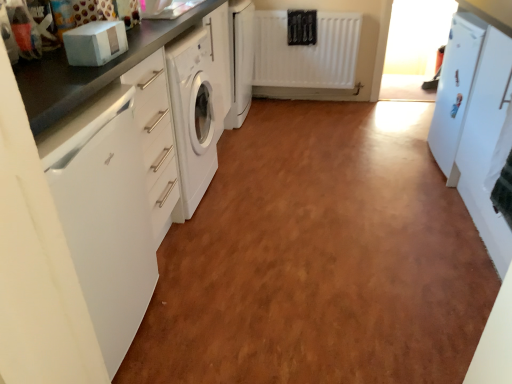
What is the approximate height of white matte refrigerator at right, arranged as the 1th cabinetry when ordered from the bottom?

white matte refrigerator at right, arranged as the 1th cabinetry when ordered from the bottom, is 36.54 inches tall.

Image resolution: width=512 pixels, height=384 pixels. Describe the element at coordinates (92, 69) in the screenshot. I see `matte black countertop at left` at that location.

Measure the distance between matte black countertop at left and camera.

A distance of 36.86 inches exists between matte black countertop at left and camera.

This screenshot has width=512, height=384. Describe the element at coordinates (240, 60) in the screenshot. I see `white glossy washing machine at center, which appears as the second cabinetry when ordered from the bottom` at that location.

From the picture: Measure the distance between white matte radiator at center and camera.

white matte radiator at center and camera are 3.28 meters apart from each other.

At what (x,y) coordinates should I click in order to perform the action: click on white glossy countertop at left. Please return your answer as a coordinate pair (x, y). The height and width of the screenshot is (384, 512). Looking at the image, I should click on (91, 70).

Where is `white matte refrigerator at right, which is the second cabinetry in top-to-bottom order`? This screenshot has width=512, height=384. white matte refrigerator at right, which is the second cabinetry in top-to-bottom order is located at coordinates tap(474, 120).

Does white glossy washing machine at center, positioned as the 1th cabinetry in top-to-bottom order, have a larger size compared to white glossy countertop at left?

No.

How different are the orientations of white glossy washing machine at center, the second cabinetry when ordered from front to back, and white glossy countertop at left in degrees?

They differ by 0.123 degrees in their facing directions.

Which object is further away from the camera taking this photo, white glossy washing machine at center, the second cabinetry in the right-to-left sequence, or white glossy countertop at left?

white glossy washing machine at center, the second cabinetry in the right-to-left sequence.

Which is closer to the camera, (233, 63) or (105, 68)?

Point (233, 63) is positioned farther from the camera compared to point (105, 68).

Where is `countertop that is behind the white matte refrigerator at right, which appears as the second cabinetry when viewed from the back`? countertop that is behind the white matte refrigerator at right, which appears as the second cabinetry when viewed from the back is located at coordinates (92, 69).

Is matte black countertop at left completely or partially outside of white matte refrigerator at right, acting as the second cabinetry starting from the left?

Yes.

Is matte black countertop at left further to the viewer compared to white matte refrigerator at right, acting as the second cabinetry starting from the left?

Yes, it is behind white matte refrigerator at right, acting as the second cabinetry starting from the left.

Is point (32, 89) closer or farther from the camera than point (486, 175)?

Point (32, 89) appears to be closer to the viewer than point (486, 175).

You are a GUI agent. You are given a task and a screenshot of the screen. Output one action in this format:
    pyautogui.click(x=<x>, y=<y>)
    Task: Click on the radiator located behind the white glossy countertop at left
    This screenshot has height=384, width=512.
    Given the screenshot: What is the action you would take?
    pyautogui.click(x=306, y=52)

Is point (326, 14) farther from camera compared to point (70, 75)?

Yes.

Looking at this image, who is more distant, white matte radiator at center or white glossy countertop at left?

white matte radiator at center is further from the camera.

From the image's perspective, relative to white matte refrigerator at right, arranged as the 1th cabinetry when viewed from the front, is white glossy washing machine at center, the second cabinetry in the right-to-left sequence, above or below?

Based on their image positions, white glossy washing machine at center, the second cabinetry in the right-to-left sequence, is located above white matte refrigerator at right, arranged as the 1th cabinetry when viewed from the front.

Is white matte refrigerator at right, which appears as the second cabinetry when viewed from the back, at the back of white glossy washing machine at center, which is the first cabinetry in back-to-front order?

white glossy washing machine at center, which is the first cabinetry in back-to-front order, is not turned away from white matte refrigerator at right, which appears as the second cabinetry when viewed from the back.

Which of these two, white glossy washing machine at center, the second cabinetry in the right-to-left sequence, or white matte refrigerator at right, which is the second cabinetry in top-to-bottom order, is thinner?

Thinner between the two is white glossy washing machine at center, the second cabinetry in the right-to-left sequence.

Which is less distant, [237,17] or [468,96]?

The point [468,96] is in front.

Is white glossy refrigerator at right at the back of white matte radiator at center?

No, white matte radiator at center is not facing the opposite direction of white glossy refrigerator at right.

Locate an element on the screen. appliance above the white matte radiator at center (from a real-world perspective) is located at coordinates (455, 89).

From the image's perspective, relative to white glossy refrigerator at right, is white matte radiator at center above or below?

From the image's perspective, white matte radiator at center appears above white glossy refrigerator at right.

Which of these two, white matte radiator at center or white glossy refrigerator at right, is thinner?

With smaller width is white matte radiator at center.

Is white glossy washing machine at center, positioned as the 1th cabinetry in top-to-bottom order, far from matte black countertop at left?

Yes, white glossy washing machine at center, positioned as the 1th cabinetry in top-to-bottom order, is far from matte black countertop at left.

In order to click on cabinetry behind the matte black countertop at left in this screenshot , I will do `click(240, 60)`.

Based on their sizes in the image, would you say white glossy washing machine at center, which appears as the second cabinetry when ordered from the bottom, is bigger or smaller than matte black countertop at left?

Clearly, white glossy washing machine at center, which appears as the second cabinetry when ordered from the bottom, is smaller in size than matte black countertop at left.

Is point (249, 77) farther from camera compared to point (57, 84)?

Yes.

Identify the location of cabinetry that is the 2nd object located above the white glossy dishwasher at left (from the image's perspective). Image resolution: width=512 pixels, height=384 pixels. (240, 60).

From the image's perspective, which one is positioned lower, white glossy dishwasher at left or white glossy washing machine at center, positioned as the 1th cabinetry in top-to-bottom order?

white glossy dishwasher at left appears lower in the image.

Is white glossy dishwasher at left taller or shorter than white glossy washing machine at center, which is the first cabinetry in back-to-front order?

Clearly, white glossy dishwasher at left is shorter compared to white glossy washing machine at center, which is the first cabinetry in back-to-front order.

Who is smaller, white glossy dishwasher at left or white glossy washing machine at center, the second cabinetry when ordered from front to back?

With smaller size is white glossy washing machine at center, the second cabinetry when ordered from front to back.

Which cabinetry is the 1st one when counting from the right side of the white glossy countertop at left? Please provide its 2D coordinates.

[(240, 60)]

What are the coordinates of `countertop that is on the left side of white matte refrigerator at right, arranged as the 1th cabinetry when viewed from the front` in the screenshot? It's located at (92, 69).

Considering their positions, is matte black countertop at left positioned closer to white matte refrigerator at right, placed as the first cabinetry when sorted from right to left, than white glossy countertop at left?

Among the two, white glossy countertop at left is located nearer to white matte refrigerator at right, placed as the first cabinetry when sorted from right to left.

Based on their spatial positions, is white glossy washing machine at center, which is the first cabinetry in back-to-front order, or white glossy countertop at left further from white matte radiator at center?

Based on the image, white glossy countertop at left appears to be further to white matte radiator at center.

From the image, which object appears to be farther from white glossy washing machine at center, the second cabinetry in the right-to-left sequence, white matte radiator at center or white matte refrigerator at right, placed as the first cabinetry when sorted from right to left?

Based on the image, white matte refrigerator at right, placed as the first cabinetry when sorted from right to left, appears to be further to white glossy washing machine at center, the second cabinetry in the right-to-left sequence.

Estimate the real-world distances between objects in this image. Which object is further from white glossy washing machine at center, the second cabinetry when ordered from front to back, matte black countertop at left or white glossy dishwasher at left?

white glossy dishwasher at left is positioned further to the anchor white glossy washing machine at center, the second cabinetry when ordered from front to back.

Which object lies nearer to the anchor point white matte radiator at center, white glossy refrigerator at right or white glossy washing machine at center, positioned as the 1th cabinetry in top-to-bottom order?

white glossy washing machine at center, positioned as the 1th cabinetry in top-to-bottom order, lies closer to white matte radiator at center than the other object.

Considering their positions, is white glossy countertop at left positioned closer to white matte refrigerator at right, acting as the second cabinetry starting from the left, than white glossy dishwasher at left?

white glossy countertop at left is closer to white matte refrigerator at right, acting as the second cabinetry starting from the left.

Estimate the real-world distances between objects in this image. Which object is closer to matte black countertop at left, white glossy dishwasher at left or white glossy countertop at left?

white glossy countertop at left.

Estimate the real-world distances between objects in this image. Which object is further from white glossy countertop at left, matte black countertop at left or white glossy washing machine at center, the second cabinetry when ordered from front to back?

white glossy washing machine at center, the second cabinetry when ordered from front to back.

You are a GUI agent. You are given a task and a screenshot of the screen. Output one action in this format:
    pyautogui.click(x=<x>, y=<y>)
    Task: Click on the countertop between white glossy countertop at left and white matte radiator at center in the front-back direction
    
    Given the screenshot: What is the action you would take?
    pyautogui.click(x=92, y=69)

Identify the location of countertop located between white glossy countertop at left and white glossy refrigerator at right in the left-right direction. (92, 69).

What are the coordinates of `counter between white glossy dishwasher at left and matte black countertop at left in the front-back direction` in the screenshot? It's located at pyautogui.click(x=91, y=70).

Where is `appliance between white matte refrigerator at right, arranged as the 1th cabinetry when viewed from the front, and white glossy washing machine at center, which appears as the second cabinetry when ordered from the bottom, from front to back`? appliance between white matte refrigerator at right, arranged as the 1th cabinetry when viewed from the front, and white glossy washing machine at center, which appears as the second cabinetry when ordered from the bottom, from front to back is located at coordinates (455, 89).